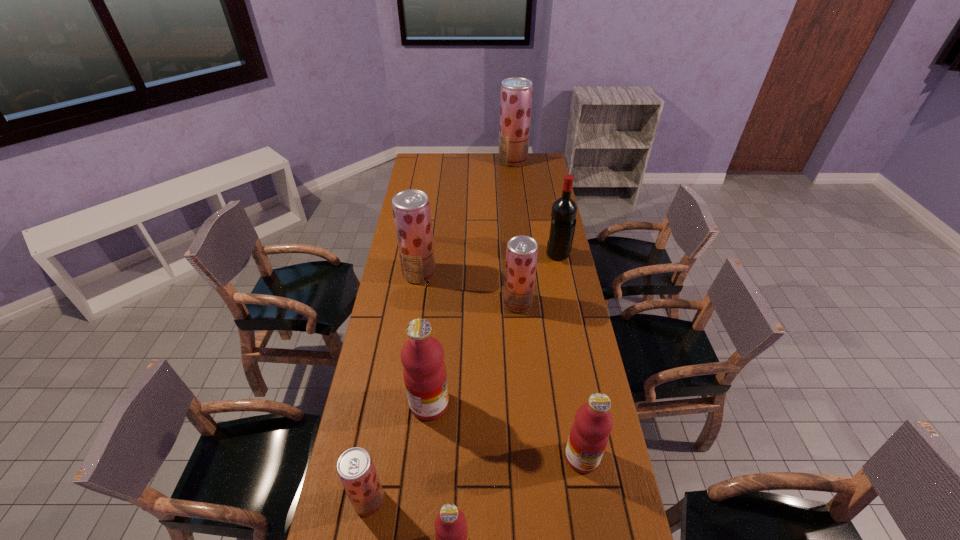
Identify the location of the third nearest object. (589, 435).

Find the location of `the second nearest fruit juice`. the second nearest fruit juice is located at coordinates click(355, 468).

Locate an element on the screen. The height and width of the screenshot is (540, 960). the seventh farthest object is located at coordinates (355, 468).

Image resolution: width=960 pixels, height=540 pixels. Find the location of `vacant space located 0.230m on the front of the tallest fruit juice`. vacant space located 0.230m on the front of the tallest fruit juice is located at coordinates click(x=516, y=190).

Locate an element on the screen. Image resolution: width=960 pixels, height=540 pixels. free location located 0.070m on the left of the red wine bottle is located at coordinates (531, 256).

You are a GUI agent. You are given a task and a screenshot of the screen. Output one action in this format:
    pyautogui.click(x=<x>, y=<y>)
    Task: Click on the vacant area situated on the back of the third smallest strawberry fruit juice
    The image size is (960, 540).
    Given the screenshot: What is the action you would take?
    pyautogui.click(x=427, y=219)

Find the location of a particular element. The height and width of the screenshot is (540, 960). vacant space located 0.280m on the label of the fourth farthest fruit juice is located at coordinates (537, 404).

Where is `vacant space positioned 0.070m on the back of the fifth nearest fruit juice`? vacant space positioned 0.070m on the back of the fifth nearest fruit juice is located at coordinates (516, 281).

Locate an element on the screen. blank area located on the label of the second nearest pink fruit juice is located at coordinates (588, 493).

Where is `free location located on the back of the second nearest object`? This screenshot has width=960, height=540. free location located on the back of the second nearest object is located at coordinates (390, 381).